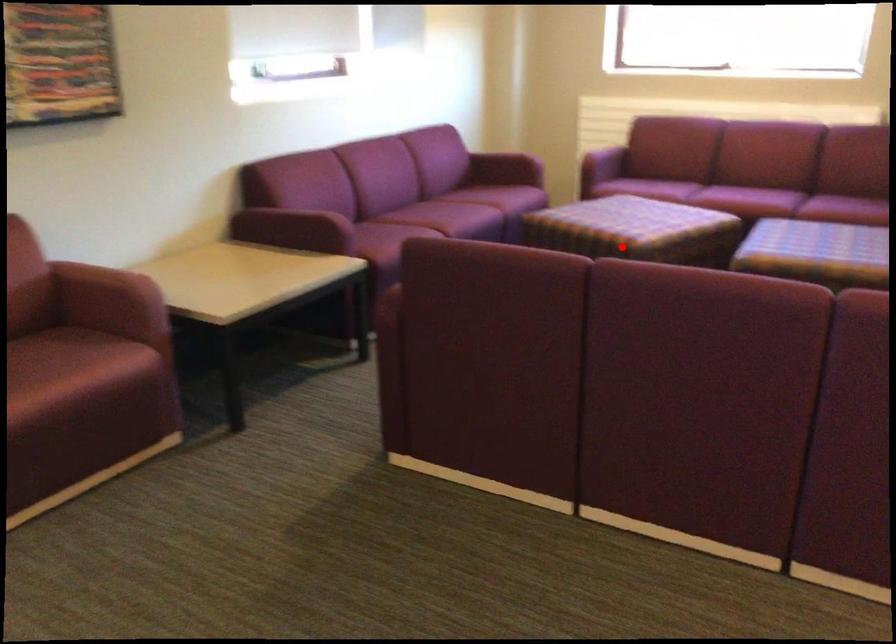
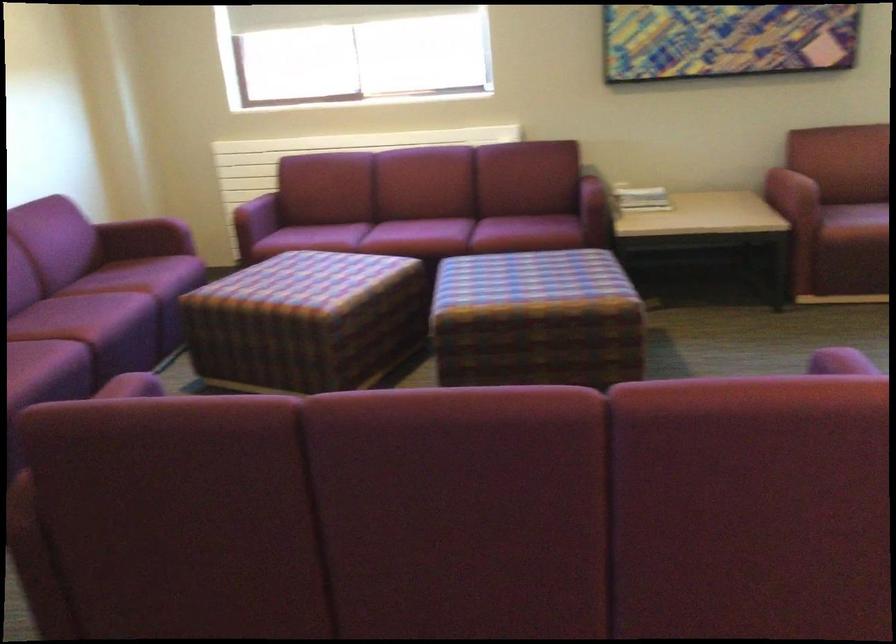
Locate, in the second image, the point that corresponds to the highlighted location in the first image.

(306, 321)